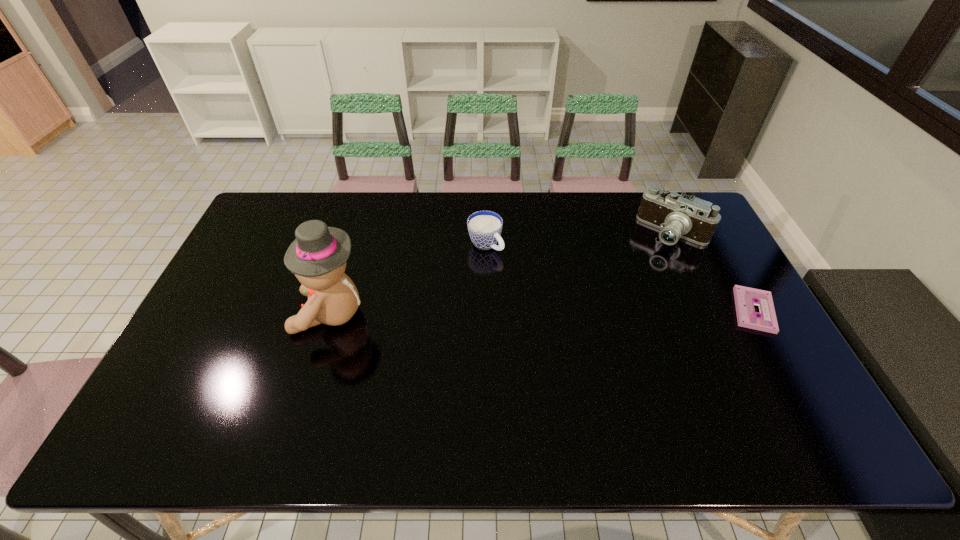
Identify the location of blank region between the videotape and the rag_doll. The image size is (960, 540). (542, 312).

The width and height of the screenshot is (960, 540). I want to click on free spot between the third tallest object and the rag_doll, so click(x=408, y=279).

I want to click on blank region between the camera and the leftmost object, so click(502, 273).

What are the coordinates of `free area in between the third tallest object and the shortest object` in the screenshot? It's located at (619, 278).

Where is `object that is the second closest to the rag_doll`? object that is the second closest to the rag_doll is located at coordinates (677, 216).

Image resolution: width=960 pixels, height=540 pixels. What are the coordinates of `object identified as the third closest to the cup` in the screenshot? It's located at tap(745, 298).

Where is `blank area in the image that satisfies the following two spatial constraints: 1. on the back side of the third object from right to left; 2. on the left side of the camera`? The width and height of the screenshot is (960, 540). blank area in the image that satisfies the following two spatial constraints: 1. on the back side of the third object from right to left; 2. on the left side of the camera is located at coordinates (486, 233).

Find the location of `free location that satisfies the following two spatial constraints: 1. on the front side of the shortest object; 2. on the right side of the cup`. free location that satisfies the following two spatial constraints: 1. on the front side of the shortest object; 2. on the right side of the cup is located at coordinates [487, 310].